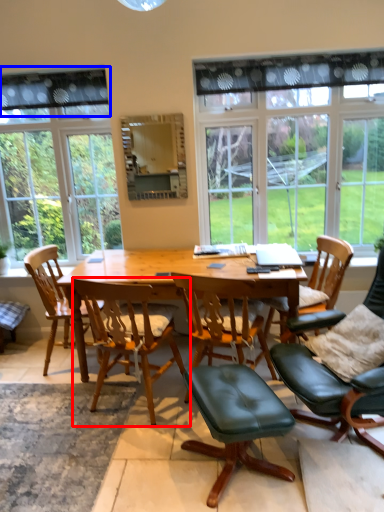
Question: Which point is closer to the camera, chair (highlighted by a red box) or curtain (highlighted by a blue box)?

Choices:
 (A) chair
 (B) curtain

Answer: (A)